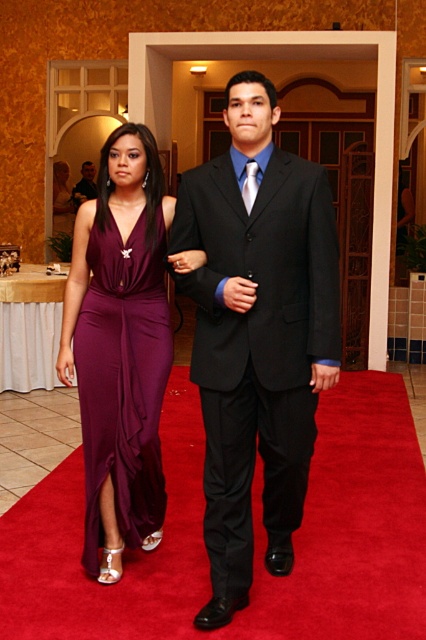
Question: Can you confirm if black satin suit at center is positioned below matte black suit at center?

Choices:
 (A) no
 (B) yes

Answer: (B)

Question: Can you confirm if black satin suit at center is positioned above matte black suit at center?

Choices:
 (A) yes
 (B) no

Answer: (B)

Question: Is black satin suit at center behind matte black suit at center?

Choices:
 (A) no
 (B) yes

Answer: (A)

Question: Which object is farther from the camera taking this photo?

Choices:
 (A) matte black suit at center
 (B) black satin suit at center

Answer: (A)

Question: Based on their relative distances, which object is nearer to the black satin suit at center?

Choices:
 (A) matte purple satin dress at center
 (B) matte black suit at center

Answer: (A)

Question: Which point is closer to the camera?

Choices:
 (A) matte purple satin dress at center
 (B) matte black suit at center
 (C) black satin suit at center

Answer: (C)